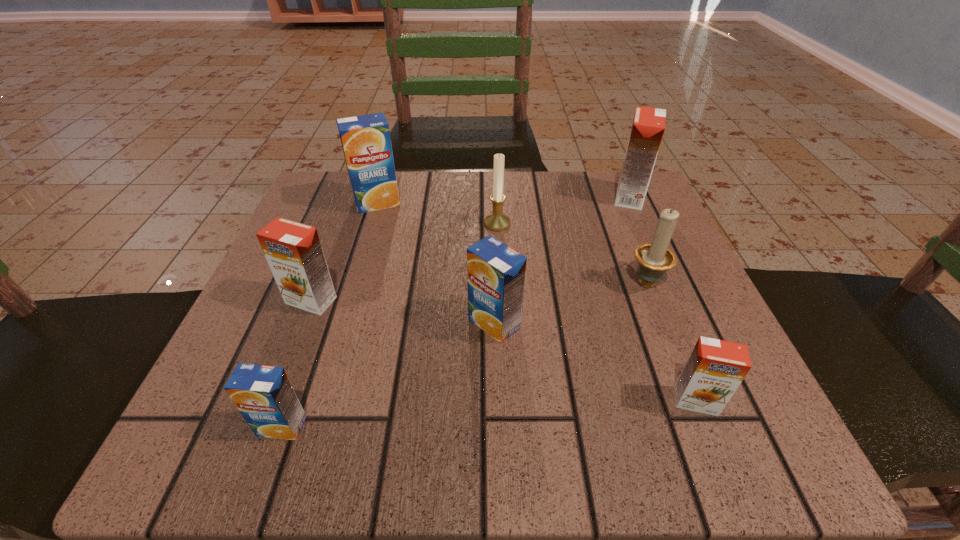
At what (x,y) coordinates should I click in order to perform the action: click on the third closest orange orange juice to the nearest blue orange_juice. Please return your answer as a coordinate pair (x, y). Image resolution: width=960 pixels, height=540 pixels. Looking at the image, I should click on (648, 127).

Where is `vacant area in the image that satisfies the following two spatial constraints: 1. on the back side of the second smallest orange orange juice; 2. on the right side of the biggest blue orange_juice`? vacant area in the image that satisfies the following two spatial constraints: 1. on the back side of the second smallest orange orange juice; 2. on the right side of the biggest blue orange_juice is located at coordinates (348, 203).

You are a GUI agent. You are given a task and a screenshot of the screen. Output one action in this format:
    pyautogui.click(x=<x>, y=<y>)
    Task: Click on the vacant space that satisfies the following two spatial constraints: 1. on the back side of the nearest blue orange_juice; 2. on the right side of the biggest orange orange juice
    The image size is (960, 540).
    Given the screenshot: What is the action you would take?
    pyautogui.click(x=363, y=197)

The image size is (960, 540). In order to click on free space that satisfies the following two spatial constraints: 1. on the handle side of the nearer candle_holder; 2. on the left side of the biggest orange orange juice in this screenshot , I will do `click(612, 197)`.

I want to click on free spot that satisfies the following two spatial constraints: 1. on the handle side of the nearer candle_holder; 2. on the left side of the farthest orange orange juice, so click(x=612, y=197).